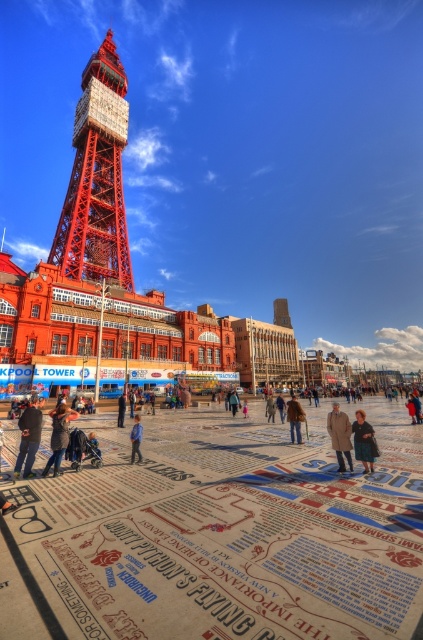
You are standing at the base of Blackpool Tower and see both the blue denim jeans at center and the blue denim jacket at center. Which item is closer to you?

The blue denim jeans at center is 22.56 meters away from the blue denim jacket at center, so the distance between them is 22.56 meters. However, without knowing their individual distances from your current position, it is impossible to determine which is closer to you.